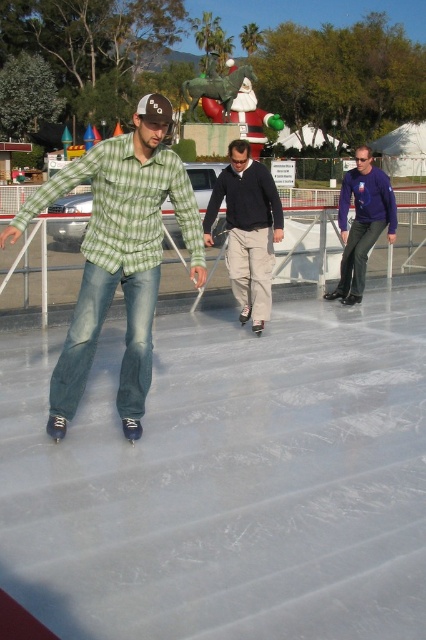
Is dark blue sweater at center shorter than matte purple sweater at center?

No.

Between dark blue sweater at center and matte purple sweater at center, which one is positioned higher?

Positioned higher is matte purple sweater at center.

Is point (241, 280) positioned in front of point (351, 237)?

That is True.

The height and width of the screenshot is (640, 426). I want to click on dark blue sweater at center, so click(x=247, y=228).

Is green plaid shirt at center smaller than matte purple sweater at center?

No.

Identify the location of green plaid shirt at center. The width and height of the screenshot is (426, 640). pyautogui.click(x=118, y=256).

Is green plaid shirt at center wider than dark blue sweater at center?

Indeed, green plaid shirt at center has a greater width compared to dark blue sweater at center.

What do you see at coordinates (118, 256) in the screenshot? The height and width of the screenshot is (640, 426). I see `green plaid shirt at center` at bounding box center [118, 256].

This screenshot has width=426, height=640. I want to click on green plaid shirt at center, so click(x=118, y=256).